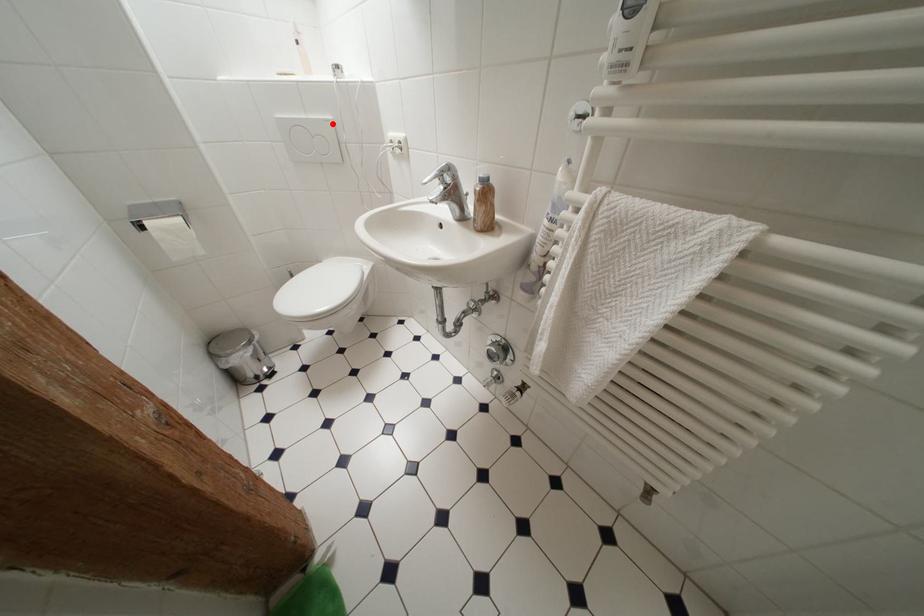
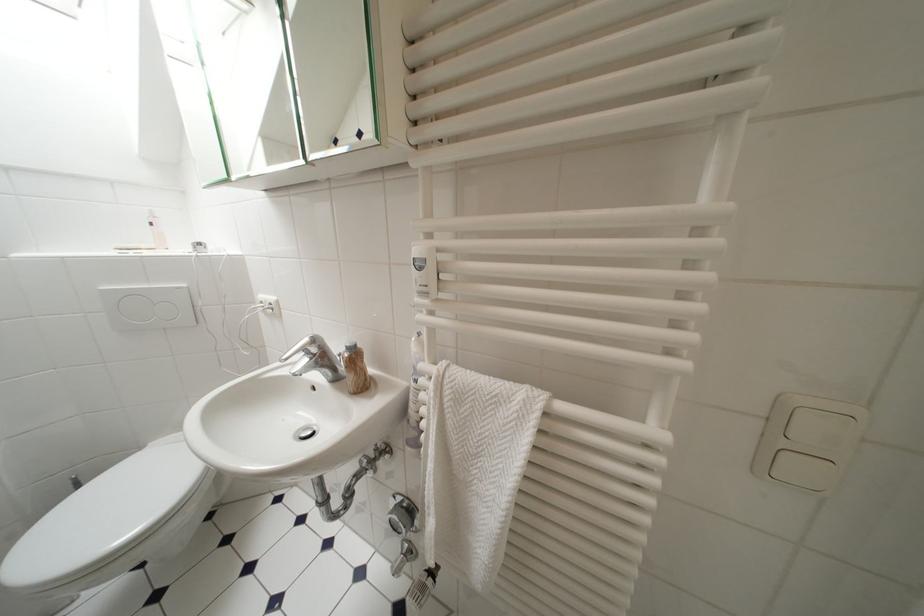
Question: I am providing you with two images of the same scene from different viewpoints. A red point is marked on the first image. At the location where the point appears in image 1, is it still visible in image 2?

Choices:
 (A) Yes
 (B) No

Answer: (A)